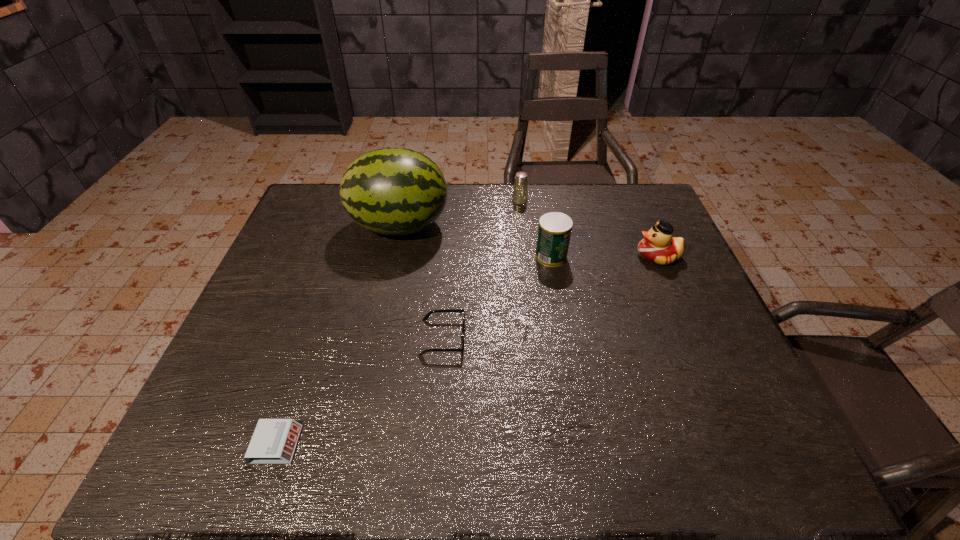
Find the location of `blank area located 0.380m on the face of the rightmost object`. blank area located 0.380m on the face of the rightmost object is located at coordinates (503, 256).

At what (x,y) coordinates should I click in order to perform the action: click on blank space located 0.390m on the face of the rightmost object. Please return your answer as a coordinate pair (x, y). This screenshot has width=960, height=540. Looking at the image, I should click on (499, 256).

This screenshot has height=540, width=960. Identify the location of free region located 0.310m on the face of the rightmost object. (527, 256).

Where is `free space located 0.300m on the left of the fourth object from left to right`? This screenshot has width=960, height=540. free space located 0.300m on the left of the fourth object from left to right is located at coordinates (421, 201).

At what (x,y) coordinates should I click in order to perform the action: click on free space located 0.250m on the front-facing side of the sunglasses. Please return your answer as a coordinate pair (x, y). The width and height of the screenshot is (960, 540). Looking at the image, I should click on (571, 337).

Find the location of a particular element. This screenshot has height=540, width=960. free space located 0.100m on the right of the alarm clock is located at coordinates (348, 444).

Image resolution: width=960 pixels, height=540 pixels. Identify the location of watermelon that is at the far edge. (393, 191).

Where is `saltshaker located at the far edge`? The image size is (960, 540). saltshaker located at the far edge is located at coordinates (520, 192).

Where is `object that is at the near edge`? object that is at the near edge is located at coordinates (274, 441).

At what (x,y) coordinates should I click in order to perform the action: click on object at the left edge. Please return your answer as a coordinate pair (x, y). Image resolution: width=960 pixels, height=540 pixels. Looking at the image, I should click on (274, 441).